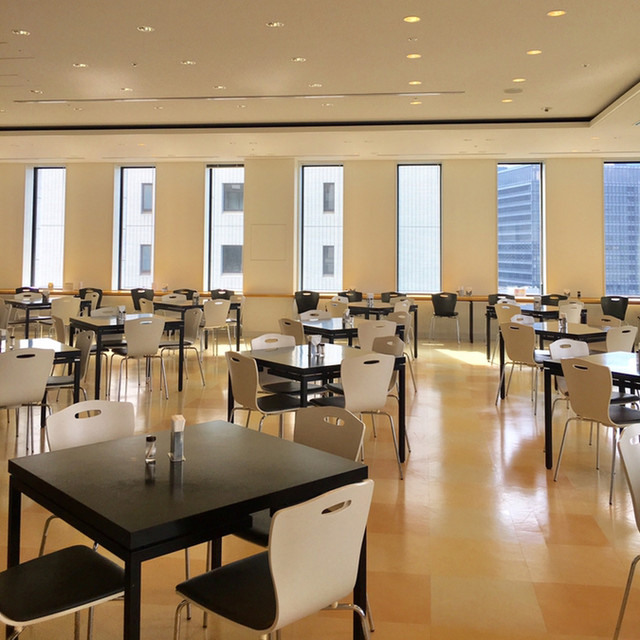
Image resolution: width=640 pixels, height=640 pixels. What are the coordinates of `items on table` in the screenshot? It's located at (150, 452), (177, 449), (308, 349), (319, 349), (566, 324), (120, 310), (44, 292), (195, 299), (369, 301).